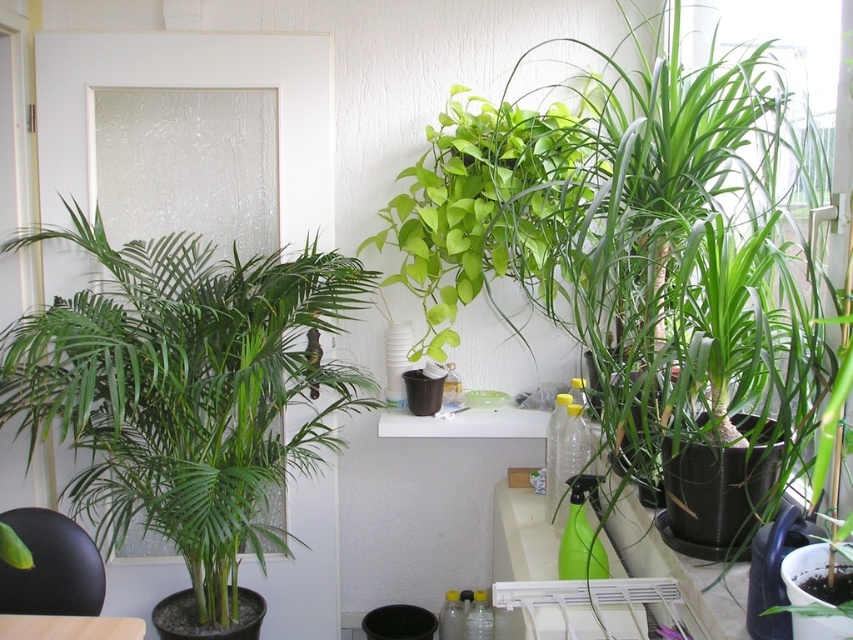
You are a photographer setting up a shot of the indoor plants. You want to focus on the point closer to the camera. Which point should you choose between point (131, 244) and point (561, 160)?

You should choose point (131, 244) because it is further to the camera than point (561, 160).

You are standing in the room and want to place a new small plant between the green leafy plant at left and the wooden table at lower left. Is there enough space between them for the new plant?

The green leafy plant at left is to the right of the wooden table at lower left, so there is space between them for the new plant.